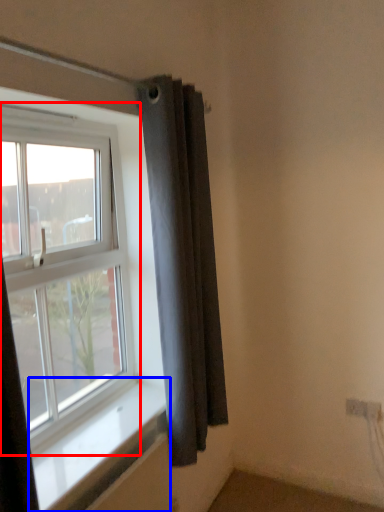
Question: Which object is further to the camera taking this photo, window (highlighted by a red box) or window sill (highlighted by a blue box)?

Choices:
 (A) window
 (B) window sill

Answer: (A)